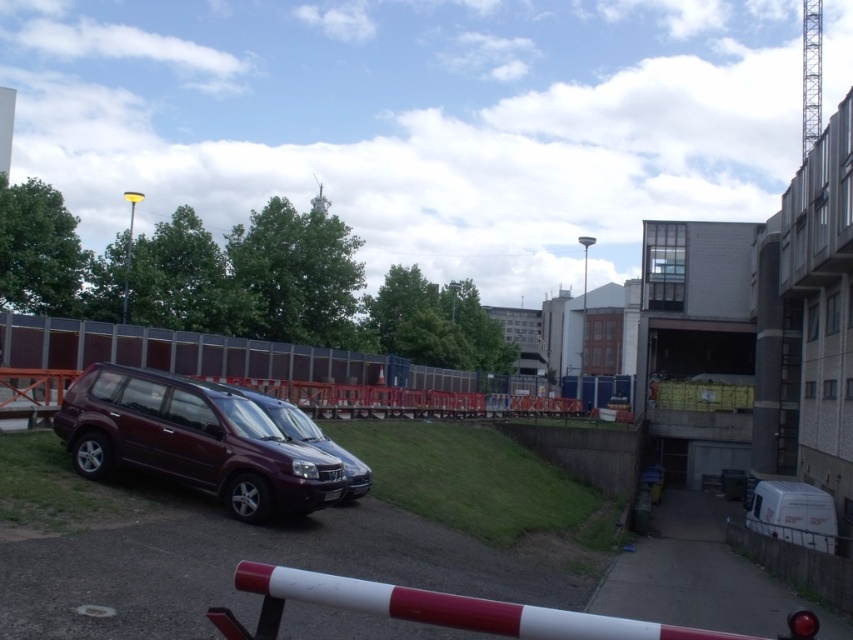
Does maroon matte suv at left appear under satin purple suv at center?

No, maroon matte suv at left is not below satin purple suv at center.

Is maroon matte suv at left positioned behind satin purple suv at center?

No, it is not.

Is point (91, 460) closer to viewer compared to point (335, 444)?

Yes, it is.

Locate an element on the screen. The image size is (853, 640). maroon matte suv at left is located at coordinates (193, 440).